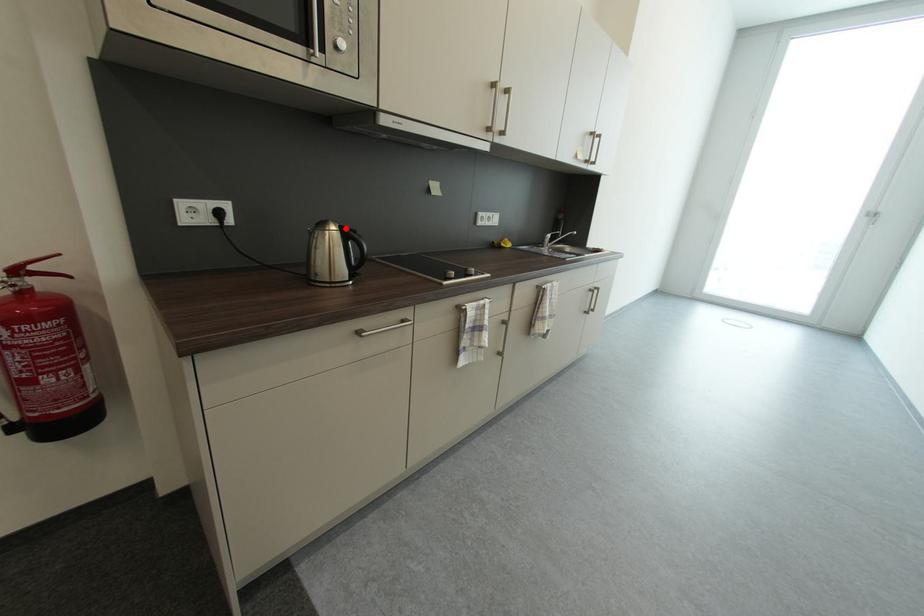
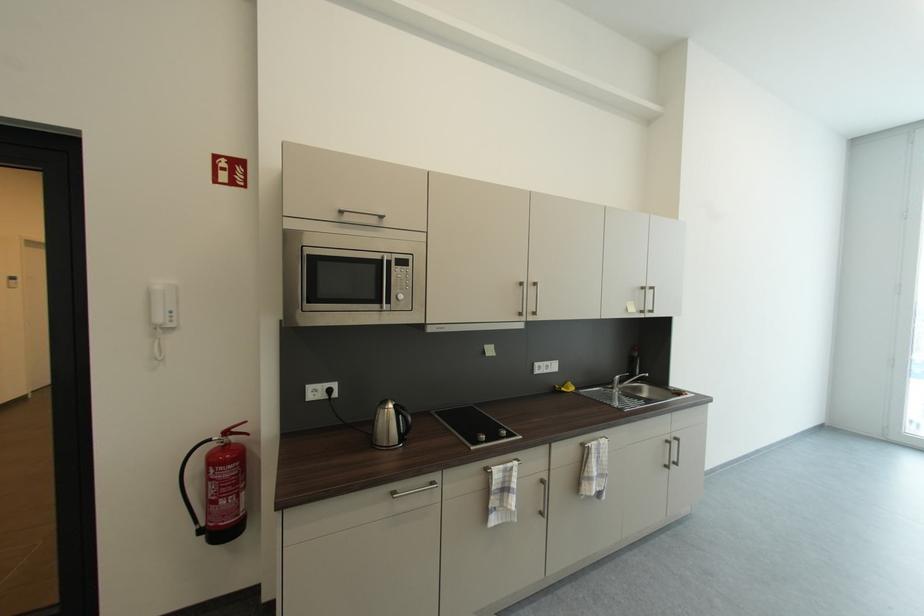
The point at the highlighted location is marked in the first image. Where is the corresponding point in the second image?

(400, 407)